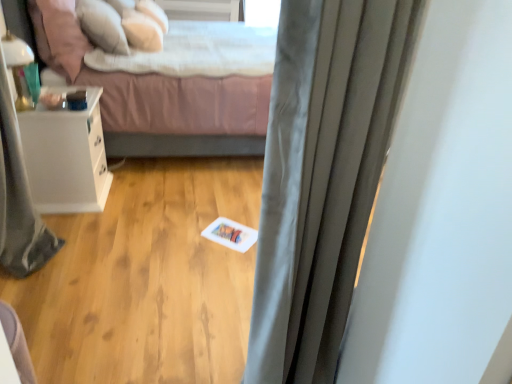
Where is `empty space that is ontop of white matte card at center (from a real-world perspective)`? This screenshot has width=512, height=384. empty space that is ontop of white matte card at center (from a real-world perspective) is located at coordinates (231, 231).